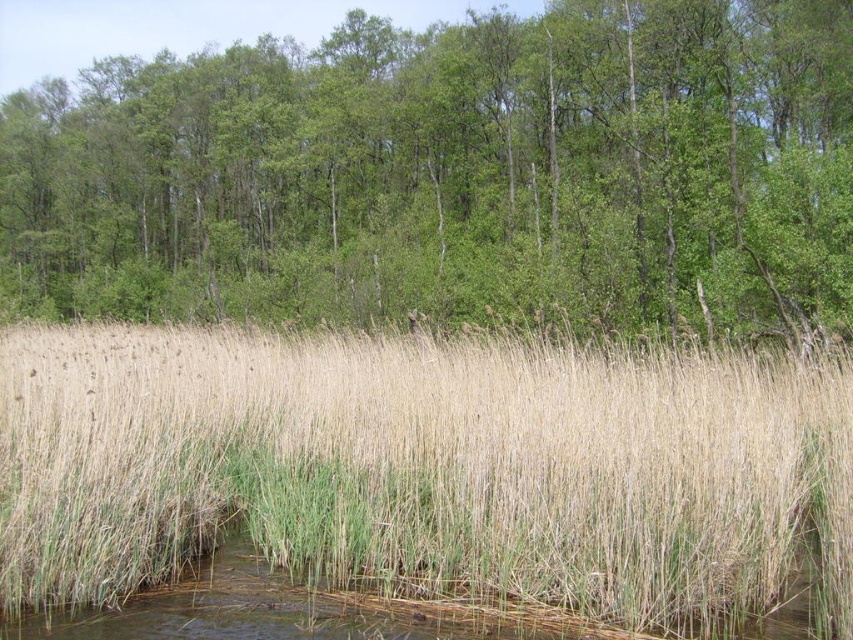
Which is more to the left, green leafy trees at upper center or dry grass at center?

Positioned to the left is green leafy trees at upper center.

Can you confirm if green leafy trees at upper center is thinner than dry grass at center?

No, green leafy trees at upper center is not thinner than dry grass at center.

Does point (556, 214) come farther from viewer compared to point (732, 433)?

Yes.

Where is `green leafy trees at upper center`? The width and height of the screenshot is (853, 640). green leafy trees at upper center is located at coordinates (454, 173).